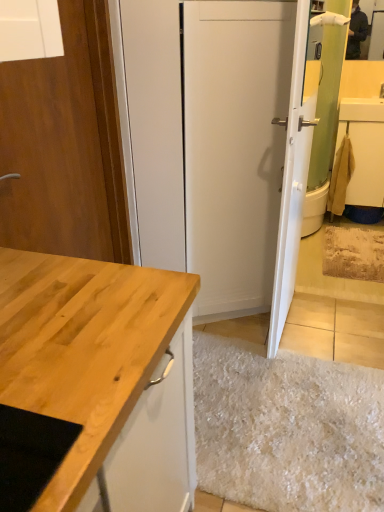
Question: Does point (377, 157) appear closer or farther from the camera than point (284, 224)?

Choices:
 (A) farther
 (B) closer

Answer: (A)

Question: Choose the correct answer: Is beige fabric towel at right inside white glossy door at upper right, which appears as the 1th door when viewed from the right, or outside it?

Choices:
 (A) outside
 (B) inside

Answer: (A)

Question: Which object is positioned closest to the wooden door at left, acting as the first door starting from the left?

Choices:
 (A) white glossy door at upper right, the 2th door when ordered from left to right
 (B) beige fabric towel at right

Answer: (A)

Question: Which is farther from the wooden door at left, which is the second door from right to left?

Choices:
 (A) white glossy door at upper right, the 2th door when ordered from left to right
 (B) beige fabric towel at right

Answer: (B)